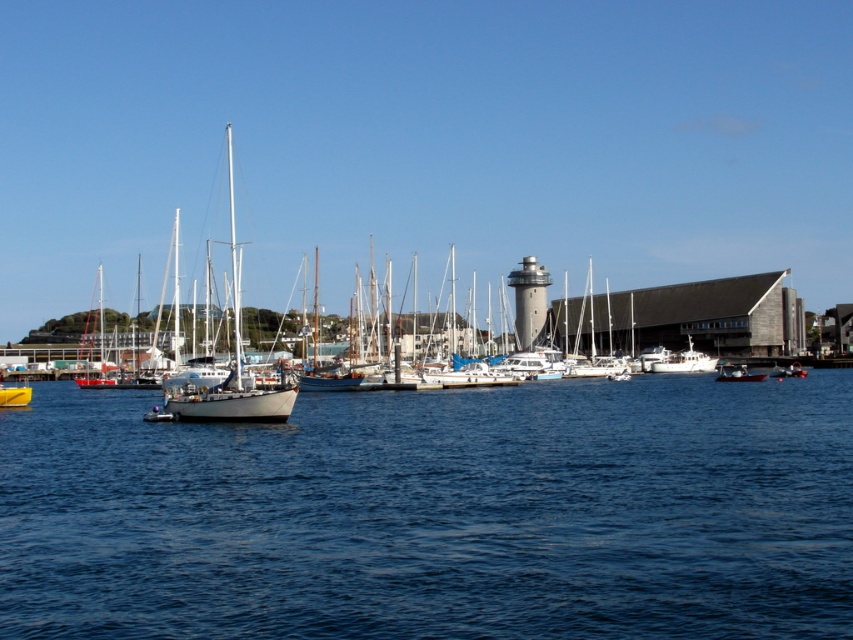
Question: Where is blue water at center located in relation to metallic silver boat at center in the image?

Choices:
 (A) left
 (B) right

Answer: (A)

Question: Can you confirm if metallic silver boat at center is wider than yellow matte boat at center?

Choices:
 (A) yes
 (B) no

Answer: (B)

Question: Does blue water at center appear under yellow matte boat at center?

Choices:
 (A) yes
 (B) no

Answer: (B)

Question: Estimate the real-world distances between objects in this image. Which object is closer to the metallic silver boat at center?

Choices:
 (A) blue water at center
 (B) yellow matte boat at center

Answer: (A)

Question: Which point appears closest to the camera in this image?

Choices:
 (A) (720, 371)
 (B) (24, 388)
 (C) (682, 516)

Answer: (C)

Question: Which point is closer to the camera taking this photo?

Choices:
 (A) (187, 632)
 (B) (729, 378)
 (C) (0, 404)

Answer: (A)